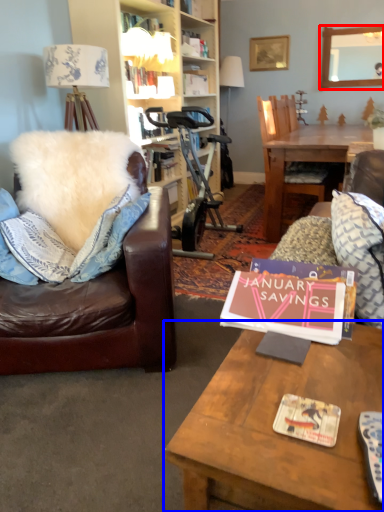
Question: Which point is closer to the camera, mirror (highlighted by a red box) or table (highlighted by a blue box)?

Choices:
 (A) mirror
 (B) table

Answer: (B)